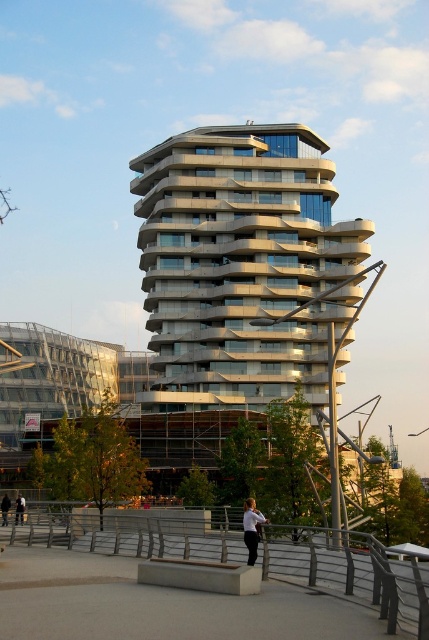
You are standing at the point marked by the coordinates point (241, 264). Looking towards the multi story building with curved design, can you see the metallic glass tower at center from your current position?

Yes, the metallic glass tower at center is exactly at point (241, 264), so you are standing directly at its location and cannot see it from your current position.